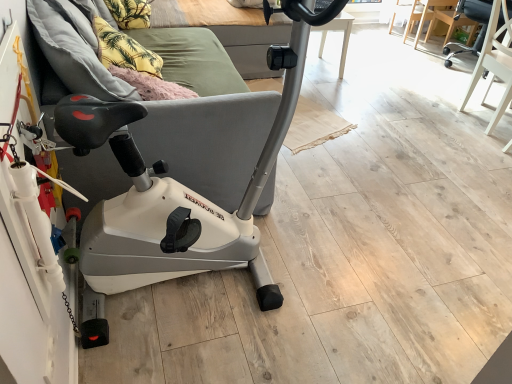
Question: Considering the relative sizes of black leather swivel chair at upper right, acting as the second swivel chair starting from the front, and wooden table at center in the image provided, is black leather swivel chair at upper right, acting as the second swivel chair starting from the front, thinner than wooden table at center?

Choices:
 (A) yes
 (B) no

Answer: (A)

Question: Can you confirm if black leather swivel chair at upper right, acting as the second swivel chair starting from the front, is shorter than wooden table at center?

Choices:
 (A) no
 (B) yes

Answer: (A)

Question: Is black leather swivel chair at upper right, placed as the 1th swivel chair when sorted from back to front, completely or partially outside of wooden table at center?

Choices:
 (A) yes
 (B) no

Answer: (A)

Question: Does black leather swivel chair at upper right, acting as the second swivel chair starting from the front, come in front of wooden table at center?

Choices:
 (A) yes
 (B) no

Answer: (A)

Question: Is black leather swivel chair at upper right, acting as the second swivel chair starting from the front, to the left of wooden table at center from the viewer's perspective?

Choices:
 (A) no
 (B) yes

Answer: (A)

Question: Are black leather swivel chair at upper right, acting as the second swivel chair starting from the front, and wooden table at center located far from each other?

Choices:
 (A) no
 (B) yes

Answer: (A)

Question: Can you confirm if yellow fabric pillow at upper left, the first pillow when ordered from top to bottom, is taller than black leather swivel chair at upper right, placed as the 1th swivel chair when sorted from back to front?

Choices:
 (A) yes
 (B) no

Answer: (B)

Question: Does yellow fabric pillow at upper left, the first pillow when ordered from top to bottom, lie in front of black leather swivel chair at upper right, acting as the second swivel chair starting from the front?

Choices:
 (A) yes
 (B) no

Answer: (A)

Question: Does yellow fabric pillow at upper left, which appears as the 1th pillow when viewed from the back, appear on the left side of black leather swivel chair at upper right, placed as the 1th swivel chair when sorted from back to front?

Choices:
 (A) no
 (B) yes

Answer: (B)

Question: From a real-world perspective, is yellow fabric pillow at upper left, acting as the 2th pillow starting from the bottom, on black leather swivel chair at upper right, acting as the second swivel chair starting from the front?

Choices:
 (A) no
 (B) yes

Answer: (B)

Question: From a real-world perspective, is yellow fabric pillow at upper left, the 2th pillow when ordered from front to back, located beneath black leather swivel chair at upper right, placed as the 1th swivel chair when sorted from back to front?

Choices:
 (A) yes
 (B) no

Answer: (B)

Question: Considering the relative sizes of yellow fabric pillow at upper left, which appears as the 1th pillow when viewed from the back, and black leather swivel chair at upper right, acting as the second swivel chair starting from the front, in the image provided, is yellow fabric pillow at upper left, which appears as the 1th pillow when viewed from the back, thinner than black leather swivel chair at upper right, acting as the second swivel chair starting from the front,?

Choices:
 (A) no
 (B) yes

Answer: (B)

Question: Is white plastic stationary bicycle at left thinner than yellow fabric pillow at upper left, which appears as the 1th pillow when viewed from the back?

Choices:
 (A) yes
 (B) no

Answer: (B)